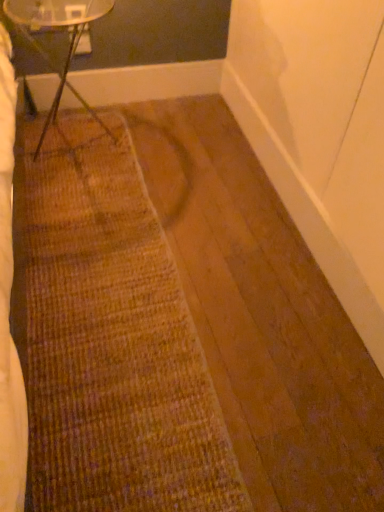
Question: Can you confirm if brown textured mat at center is smaller than clear glass table at upper left?

Choices:
 (A) no
 (B) yes

Answer: (B)

Question: Is brown textured mat at center far from clear glass table at upper left?

Choices:
 (A) yes
 (B) no

Answer: (B)

Question: Is brown textured mat at center thinner than clear glass table at upper left?

Choices:
 (A) no
 (B) yes

Answer: (A)

Question: From the image's perspective, does brown textured mat at center appear lower than clear glass table at upper left?

Choices:
 (A) no
 (B) yes

Answer: (B)

Question: From a real-world perspective, is brown textured mat at center located beneath clear glass table at upper left?

Choices:
 (A) no
 (B) yes

Answer: (B)

Question: From a real-world perspective, is brown textured mat at center on clear glass table at upper left?

Choices:
 (A) no
 (B) yes

Answer: (A)

Question: Is clear glass table at upper left looking in the opposite direction of brown textured mat at center?

Choices:
 (A) yes
 (B) no

Answer: (B)

Question: Can you confirm if clear glass table at upper left is wider than brown textured mat at center?

Choices:
 (A) yes
 (B) no

Answer: (B)

Question: Is the depth of clear glass table at upper left less than that of brown textured mat at center?

Choices:
 (A) yes
 (B) no

Answer: (B)

Question: Is clear glass table at upper left shorter than brown textured mat at center?

Choices:
 (A) yes
 (B) no

Answer: (B)

Question: Is clear glass table at upper left smaller than brown textured mat at center?

Choices:
 (A) no
 (B) yes

Answer: (A)

Question: Does clear glass table at upper left have a larger size compared to brown textured mat at center?

Choices:
 (A) yes
 (B) no

Answer: (A)

Question: From a real-world perspective, relative to clear glass table at upper left, is brown textured mat at center vertically above or below?

Choices:
 (A) below
 (B) above

Answer: (A)